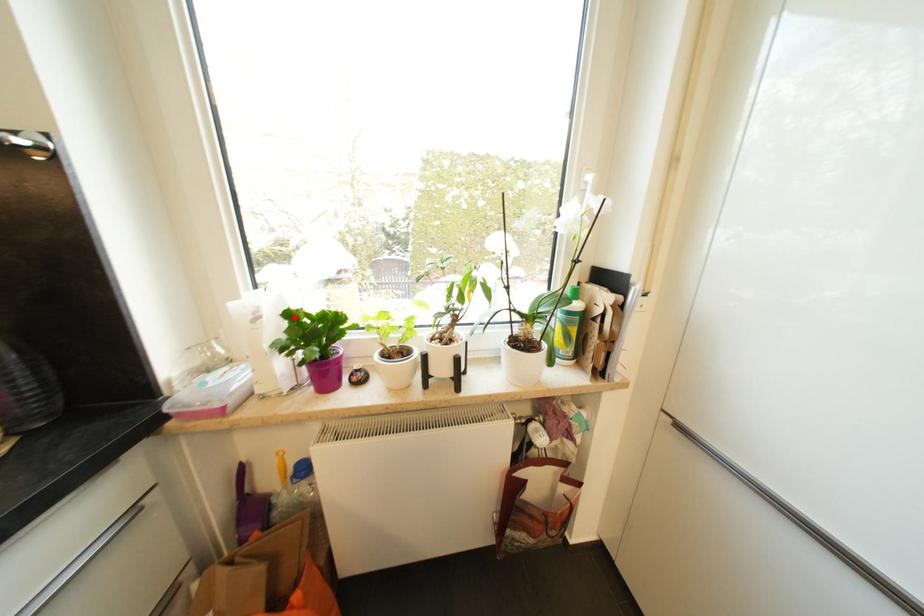
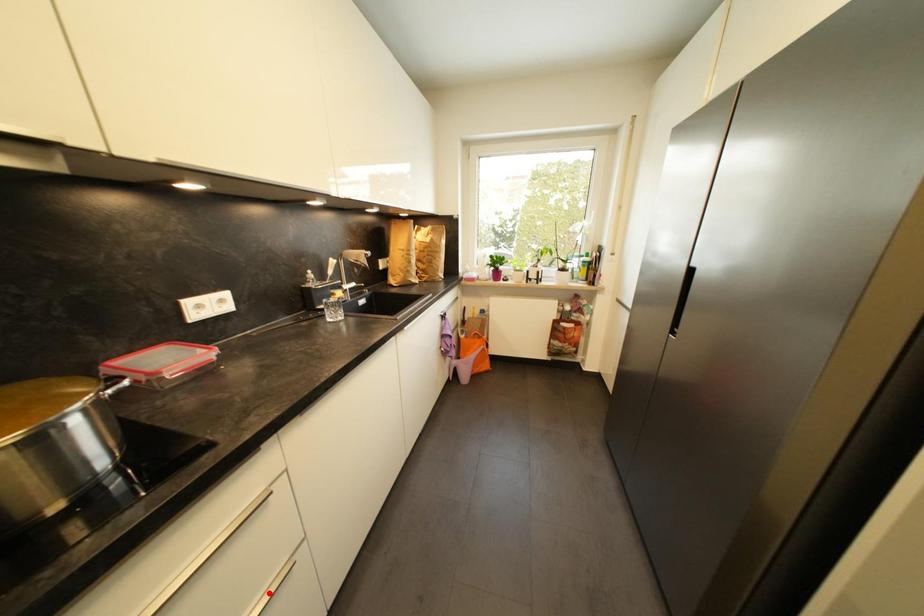
I am providing you with two images of the same scene from different viewpoints. A red point is marked on the first image and another point is marked on the second image. Are the points marked in image1 and image2 representing the same 3D position?

No